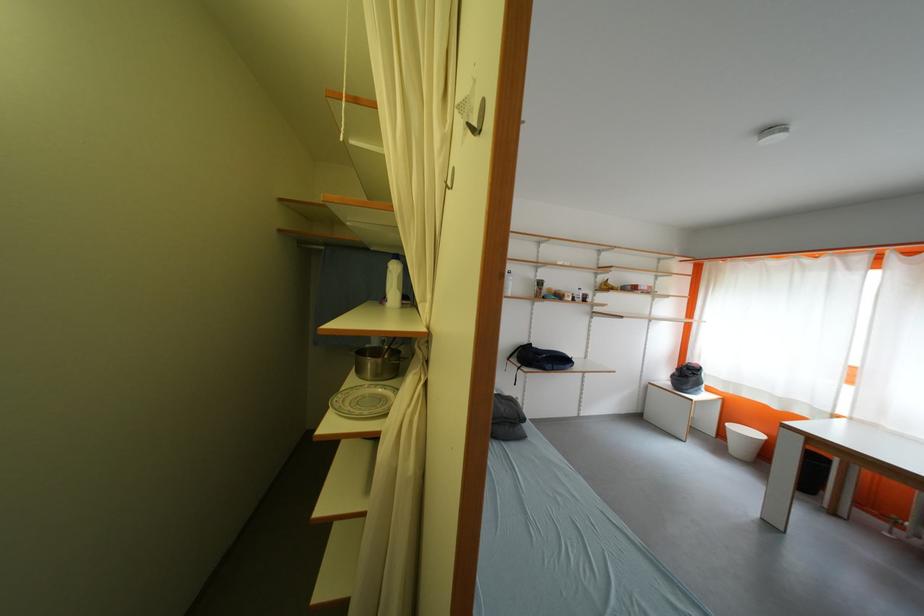
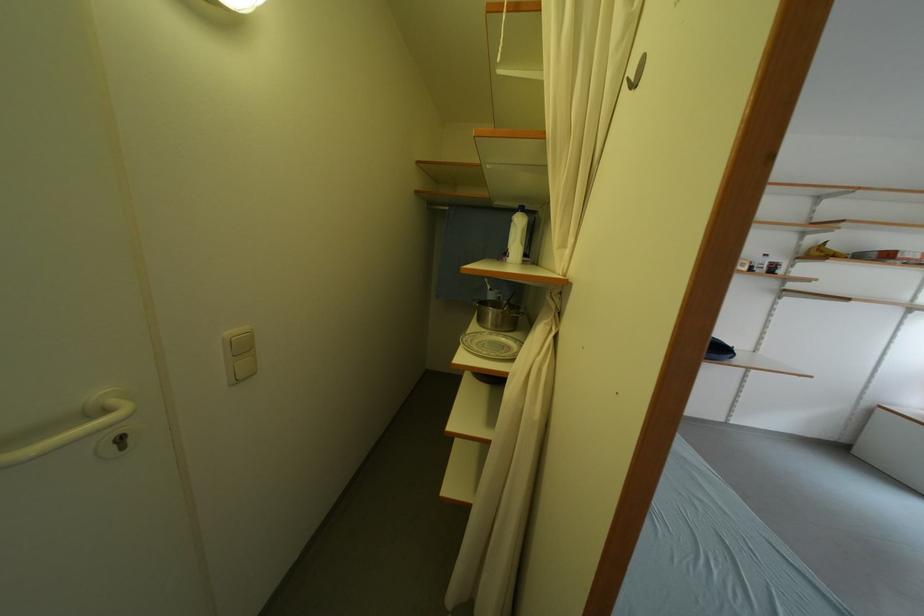
The point at (348, 399) is marked in the first image. Where is the corresponding point in the second image?

(476, 339)